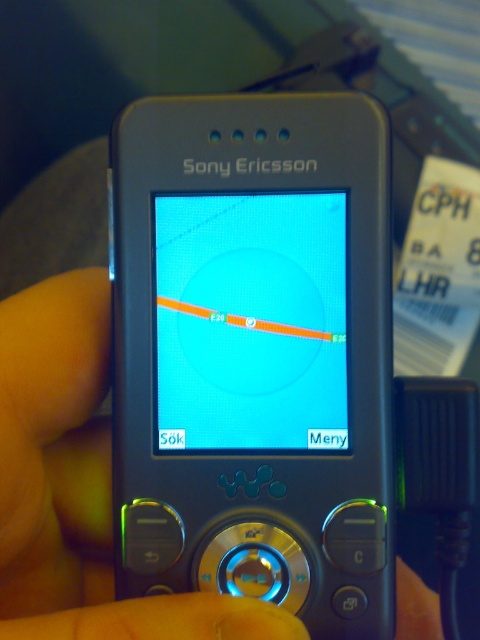
Question: Which of the following is the closest to the observer?

Choices:
 (A) blue glossy screen at center
 (B) metallic gray hand at center

Answer: (B)

Question: Can you confirm if metallic gray hand at center is positioned to the right of blue glossy screen at center?

Choices:
 (A) yes
 (B) no

Answer: (B)

Question: Observing the image, what is the correct spatial positioning of metallic gray hand at center in reference to blue glossy screen at center?

Choices:
 (A) left
 (B) right

Answer: (A)

Question: Considering the relative positions of metallic gray hand at center and blue glossy screen at center in the image provided, where is metallic gray hand at center located with respect to blue glossy screen at center?

Choices:
 (A) below
 (B) above

Answer: (A)

Question: Which point is closer to the camera?

Choices:
 (A) (264, 417)
 (B) (94, 564)

Answer: (A)

Question: Which of the following is the closest to the observer?

Choices:
 (A) blue glossy screen at center
 (B) metallic gray hand at center

Answer: (B)